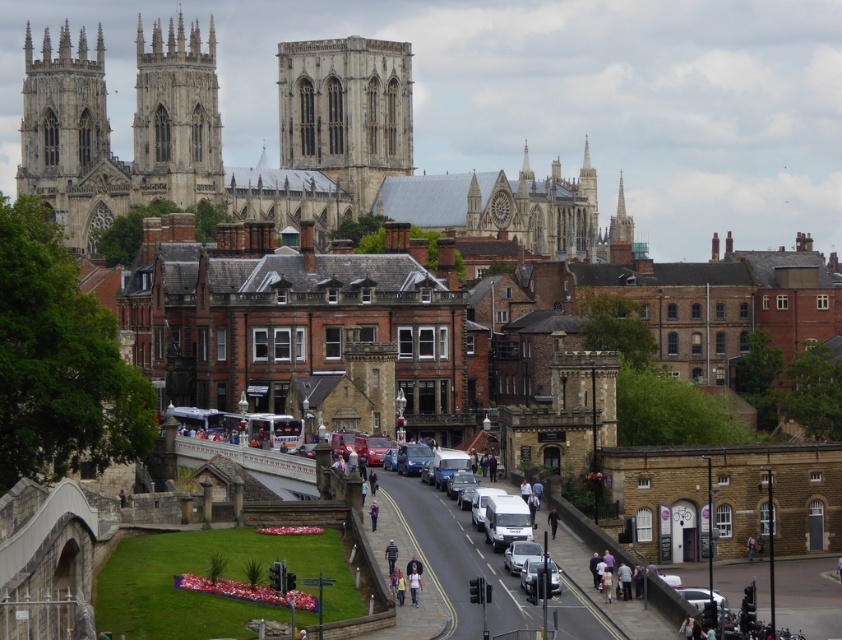
Question: Among these objects, which one is nearest to the camera?

Choices:
 (A) blue striped shirt at center
 (B) stone gothic tower at center

Answer: (A)

Question: In this image, where is metallic silver car at center located relative to blue striped shirt at center?

Choices:
 (A) left
 (B) right

Answer: (B)

Question: Can you confirm if metallic silver car at center is positioned above metallic silver car at lower right?

Choices:
 (A) yes
 (B) no

Answer: (A)

Question: Is metallic silver car at lower right to the right of purple fabric jacket at center from the viewer's perspective?

Choices:
 (A) no
 (B) yes

Answer: (B)

Question: Which is farther from the blue striped shirt at center?

Choices:
 (A) purple fabric jacket at center
 (B) light blue jeans at center

Answer: (A)

Question: Estimate the real-world distances between objects in this image. Which object is closer to the purple fabric jacket at center?

Choices:
 (A) light blue jeans at center
 (B) stone gothic tower at center

Answer: (A)